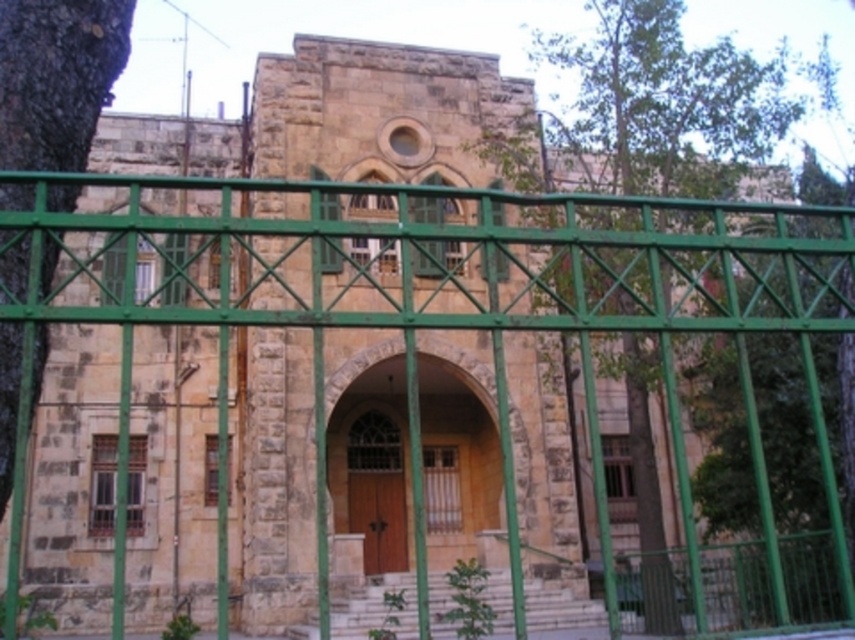
You are a visitor approaching the stone building and want to see the arched doorway clearly. The green metal fence at center and green leafy tree at center are blocking your view. Which object should you move to get a better view?

The green metal fence at center has a larger size compared to green leafy tree at center, so you should move the green metal fence at center to get a better view of the arched doorway.

You are a visitor approaching the stone building and see the green leafy tree at center and the dark green bark tree at left. Which tree is closer to the building?

The green leafy tree at center is closer to the building because it is bigger than the dark green bark tree at left, indicating it is nearer due to perspective.